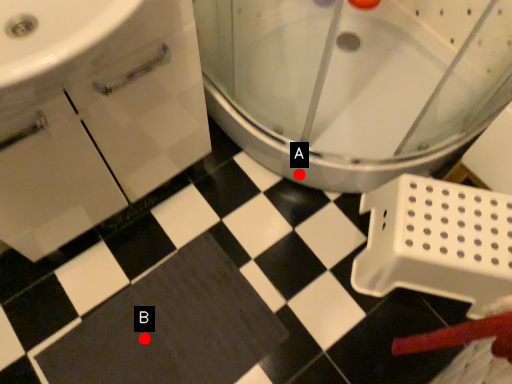
Question: Two points are circled on the image, labeled by A and B beside each circle. Which of the following is the closest to the observer?

Choices:
 (A) A is closer
 (B) B is closer

Answer: (B)